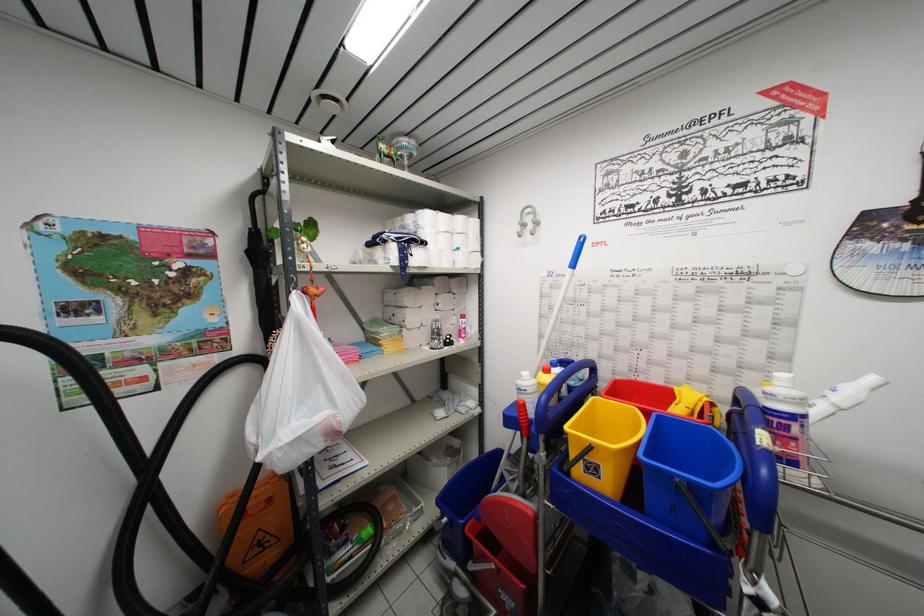
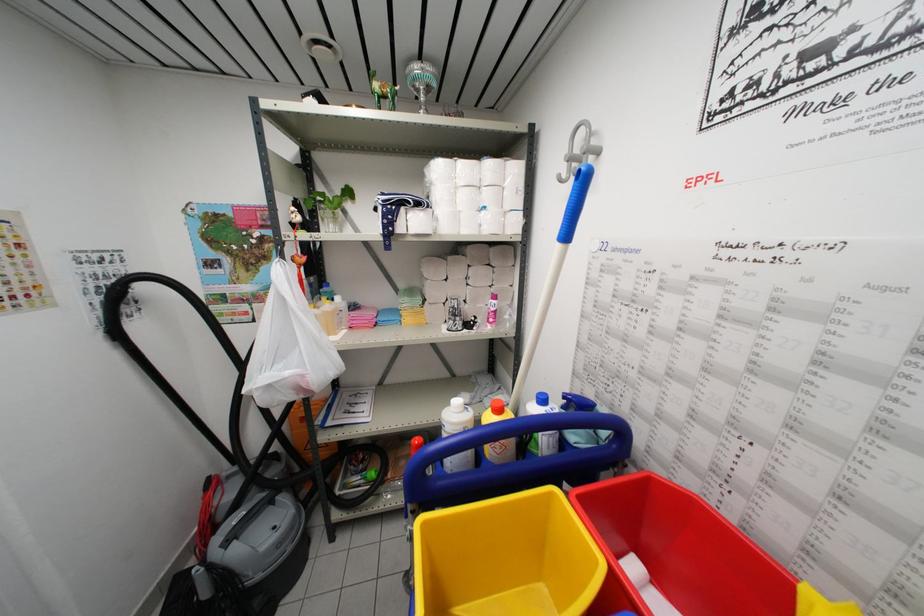
The point at (285, 450) is marked in the first image. Where is the corresponding point in the second image?

(258, 392)